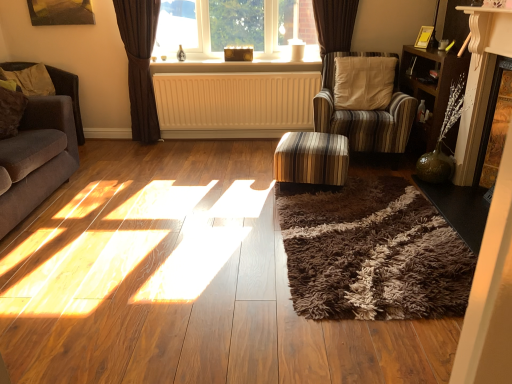
What do you see at coordinates (68, 95) in the screenshot? I see `brown fabric armchair at left` at bounding box center [68, 95].

The width and height of the screenshot is (512, 384). I want to click on brown fabric armchair at left, so click(x=68, y=95).

The width and height of the screenshot is (512, 384). What do you see at coordinates (430, 86) in the screenshot?
I see `wooden bookshelf at right` at bounding box center [430, 86].

In order to face wooden bookshelf at right, should I rotate leftwards or rightwards?

Rotate your view right by about 22.346°.

Locate an element on the screen. clear glass window at center is located at coordinates (236, 27).

Locate an element on the screen. brown fabric curtain at upper center is located at coordinates (140, 64).

Consider the image. Measure the distance between yellow matte radiator at center and camera.

yellow matte radiator at center and camera are 3.88 meters apart.

Where is `striped fabric ottoman at center`? striped fabric ottoman at center is located at coordinates (312, 158).

I want to click on brown fabric armchair at left, so click(68, 95).

Considering the relative sizes of white plastic radiator at center and striped fabric chair at center-right in the image provided, is white plastic radiator at center wider than striped fabric chair at center-right?

Incorrect, the width of white plastic radiator at center does not surpass that of striped fabric chair at center-right.

Is white plastic radiator at center outside of striped fabric chair at center-right?

Yes, white plastic radiator at center is located beyond the bounds of striped fabric chair at center-right.

Is striped fabric chair at center-right at the back of white plastic radiator at center?

No, white plastic radiator at center's orientation is not away from striped fabric chair at center-right.

Is striped fabric ottoman at center shorter than wooden picture frame at upper right?

No, striped fabric ottoman at center is not shorter than wooden picture frame at upper right.

From the image's perspective, who appears lower, striped fabric ottoman at center or wooden picture frame at upper right?

striped fabric ottoman at center, from the image's perspective.

From a real-world perspective, is striped fabric ottoman at center located higher than wooden picture frame at upper right?

No, from a real-world perspective, striped fabric ottoman at center is not on top of wooden picture frame at upper right.

Is point (309, 132) more distant than point (422, 26)?

No, (309, 132) is closer to viewer.

Considering the relative sizes of clear glass window at center and striped fabric chair at center-right in the image provided, is clear glass window at center shorter than striped fabric chair at center-right?

Yes, clear glass window at center is shorter than striped fabric chair at center-right.

Can you confirm if clear glass window at center is wider than striped fabric chair at center-right?

Incorrect, the width of clear glass window at center does not surpass that of striped fabric chair at center-right.

Does white plastic radiator at center lie behind brown fabric curtain at upper center?

Yes, the depth of white plastic radiator at center is greater than that of brown fabric curtain at upper center.

Is white plastic radiator at center aimed at brown fabric curtain at upper center?

Yes, white plastic radiator at center is oriented towards brown fabric curtain at upper center.

From the image's perspective, relative to brown fabric curtain at upper center, is white plastic radiator at center above or below?

white plastic radiator at center is situated higher than brown fabric curtain at upper center in the image.

Consider the image. Is white plastic radiator at center far from brown fabric curtain at upper center?

white plastic radiator at center is near brown fabric curtain at upper center, not far away.

Find the location of a particular element. This screenshot has height=384, width=512. armchair that is in front of the white plastic radiator at center is located at coordinates (68, 95).

Relative to brown fabric armchair at left, is white plastic radiator at center in front or behind?

In the image, white plastic radiator at center appears behind brown fabric armchair at left.

Does white plastic radiator at center have a greater width compared to brown fabric armchair at left?

Incorrect, the width of white plastic radiator at center does not surpass that of brown fabric armchair at left.

Is white plastic radiator at center inside or outside of brown fabric armchair at left?

white plastic radiator at center is outside brown fabric armchair at left.

Looking at their sizes, would you say brown fabric armchair at left is wider or thinner than wooden picture frame at upper right?

brown fabric armchair at left is wider than wooden picture frame at upper right.

Would you say brown fabric armchair at left contains wooden picture frame at upper right?

No, brown fabric armchair at left does not contain wooden picture frame at upper right.

From a real-world perspective, is brown fabric armchair at left above or below wooden picture frame at upper right?

brown fabric armchair at left is situated lower than wooden picture frame at upper right in the real world.

Is point (245, 72) closer to camera compared to point (25, 212)?

That is False.

From the image's perspective, which one is positioned higher, white plastic radiator at center or velvet brown couch at left?

white plastic radiator at center is shown above in the image.

Considering the sizes of objects white plastic radiator at center and velvet brown couch at left in the image provided, who is wider, white plastic radiator at center or velvet brown couch at left?

Wider between the two is velvet brown couch at left.

Is white plastic radiator at center next to velvet brown couch at left and touching it?

white plastic radiator at center and velvet brown couch at left are not in contact.

You are a GUI agent. You are given a task and a screenshot of the screen. Output one action in this format:
    pyautogui.click(x=<x>, y=<y>)
    Task: Click on the chair below the white plastic radiator at center (from the image's perspective)
    The image size is (512, 384).
    Given the screenshot: What is the action you would take?
    pyautogui.click(x=365, y=113)

The height and width of the screenshot is (384, 512). In order to click on stool in front of the wooden picture frame at upper right in this screenshot , I will do [312, 158].

Estimate the real-world distances between objects in this image. Which object is further from wooden picture frame at upper right, brown fabric armchair at left or clear glass window at center?

Based on the image, brown fabric armchair at left appears to be further to wooden picture frame at upper right.

From the image, which object appears to be farther from clear glass window at center, striped fabric ottoman at center or white plastic radiator at center?

striped fabric ottoman at center is further to clear glass window at center.

Estimate the real-world distances between objects in this image. Which object is closer to clear glass window at center, wooden bookshelf at right or striped fabric chair at center-right?

Based on the image, striped fabric chair at center-right appears to be nearer to clear glass window at center.

From the image, which object appears to be nearer to clear glass window at center, wooden picture frame at upper right or white plastic radiator at center?

The object closer to clear glass window at center is white plastic radiator at center.

Which object lies nearer to the anchor point striped fabric chair at center-right, velvet brown couch at left or striped fabric ottoman at center?

striped fabric ottoman at center.

When comparing their distances from striped fabric ottoman at center, does brown fabric curtain at upper center or clear glass window at center seem further?

brown fabric curtain at upper center is further to striped fabric ottoman at center.

Estimate the real-world distances between objects in this image. Which object is closer to velvet brown couch at left, wooden picture frame at upper right or soft beige fabric pillow at left?

The object closer to velvet brown couch at left is soft beige fabric pillow at left.

Which object lies nearer to the anchor point white plastic radiator at center, soft beige fabric pillow at left or clear glass window at center?

clear glass window at center lies closer to white plastic radiator at center than the other object.

This screenshot has height=384, width=512. What are the coordinates of `picture frame between clear glass window at center and wooden bookshelf at right in the horizontal direction` in the screenshot? It's located at (424, 37).

Locate an element on the screen. radiator between velvet brown couch at left and striped fabric ottoman at center is located at coordinates (234, 104).

You are a GUI agent. You are given a task and a screenshot of the screen. Output one action in this format:
    pyautogui.click(x=<x>, y=<y>)
    Task: Click on the radiator located between striped fabric ottoman at center and white plastic radiator at center in the depth direction
    
    Given the screenshot: What is the action you would take?
    pyautogui.click(x=234, y=104)

Where is `window between brown fabric armchair at left and wooden picture frame at upper right from left to right`? Image resolution: width=512 pixels, height=384 pixels. window between brown fabric armchair at left and wooden picture frame at upper right from left to right is located at coordinates (236, 27).